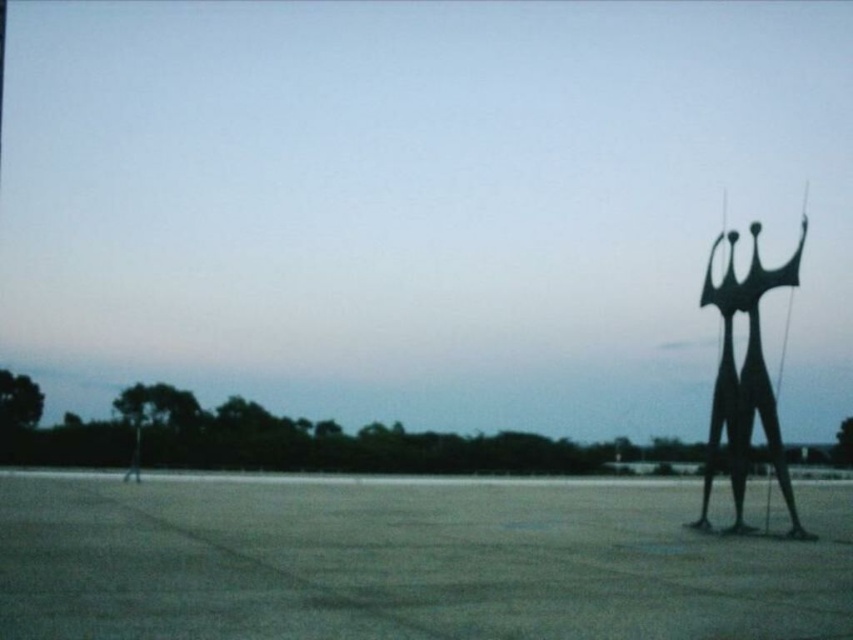
Question: Does smooth concrete tarmac at right appear over black metal sculpture at right?

Choices:
 (A) no
 (B) yes

Answer: (A)

Question: Does smooth concrete tarmac at right have a lesser width compared to black metal sculpture at right?

Choices:
 (A) no
 (B) yes

Answer: (A)

Question: Which point is farther to the camera?

Choices:
 (A) (39, 566)
 (B) (755, 288)

Answer: (B)

Question: Does smooth concrete tarmac at right appear on the left side of black metal sculpture at right?

Choices:
 (A) no
 (B) yes

Answer: (B)

Question: Which point is closer to the camera?

Choices:
 (A) (4, 625)
 (B) (770, 456)

Answer: (A)